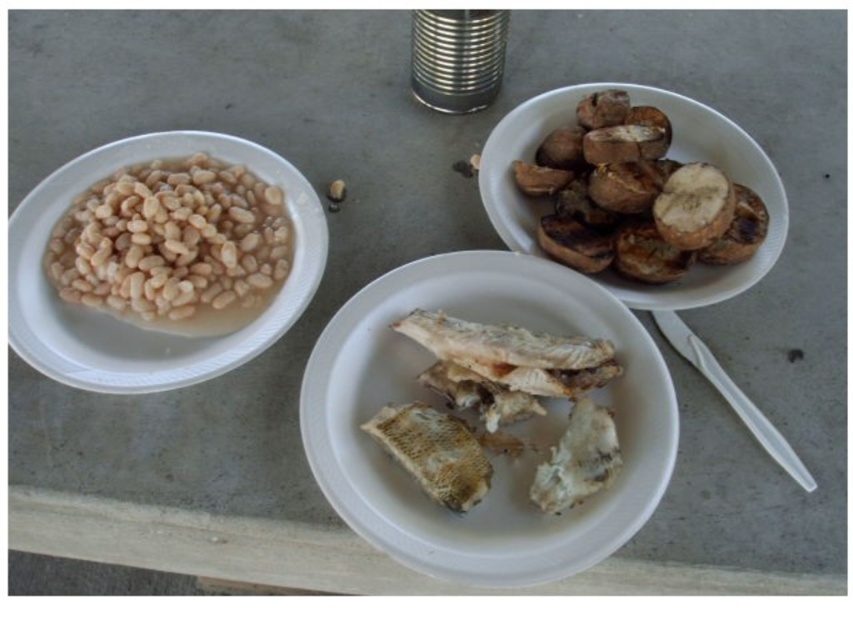
Does white plastic fork at lower right have a greater width compared to matte brown nut at center?

Yes.

Is white plastic fork at lower right taller than matte brown nut at center?

Correct, white plastic fork at lower right is much taller as matte brown nut at center.

Which is behind, point (811, 481) or point (334, 198)?

The point (334, 198) is more distant.

The image size is (853, 640). Find the location of `white plastic fork at lower right`. white plastic fork at lower right is located at coordinates (732, 396).

Does white matte plate at center have a lesser width compared to matte brown nut at center?

Incorrect, white matte plate at center's width is not less than matte brown nut at center's.

Does point (303, 428) come behind point (334, 196)?

No, it is not.

Locate an element on the screen. This screenshot has width=853, height=640. white matte plate at center is located at coordinates (509, 428).

The width and height of the screenshot is (853, 640). Describe the element at coordinates (502, 410) in the screenshot. I see `brown crispy fish at center` at that location.

Is point (468, 392) behind point (636, 218)?

No, (468, 392) is closer to viewer.

Is point (495, 355) positioned in front of point (723, 177)?

That is True.

The height and width of the screenshot is (640, 853). What are the coordinates of `brown crispy fish at center` in the screenshot? It's located at (502, 410).